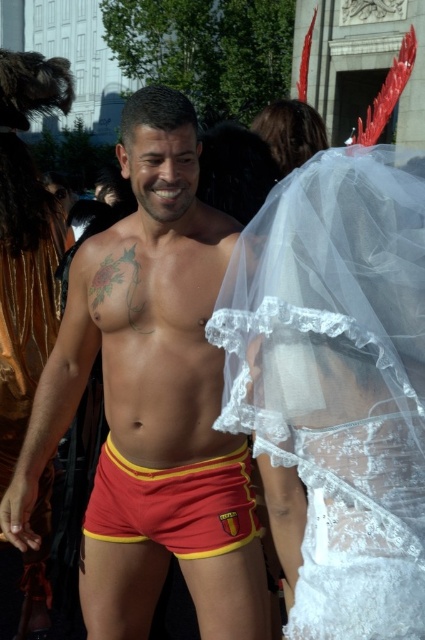
At what (x,y) coordinates should I click in order to perform the action: click on white lace veil at upper center. Please return your answer as a coordinate pair (x, y). The height and width of the screenshot is (640, 425). Looking at the image, I should click on (339, 380).

Is white lace veil at upper center bigger than red/yellow fabric shorts at center?

Correct, white lace veil at upper center is larger in size than red/yellow fabric shorts at center.

Find the location of a particular element. The height and width of the screenshot is (640, 425). white lace veil at upper center is located at coordinates (339, 380).

Which is more to the right, matte red shorts at center or red/yellow fabric shorts at center?

red/yellow fabric shorts at center is more to the right.

Does matte red shorts at center have a greater height compared to red/yellow fabric shorts at center?

Correct, matte red shorts at center is much taller as red/yellow fabric shorts at center.

Is point (54, 360) positioned in front of point (180, 472)?

That is False.

At what (x,y) coordinates should I click in order to perform the action: click on matte red shorts at center. Please return your answer as a coordinate pair (x, y). This screenshot has width=425, height=640. Looking at the image, I should click on (139, 316).

Does white lace veil at upper center have a greater width compared to matte red shorts at center?

Incorrect, white lace veil at upper center's width does not surpass matte red shorts at center's.

Is white lace veil at upper center to the right of matte red shorts at center from the viewer's perspective?

Yes, white lace veil at upper center is to the right of matte red shorts at center.

Is point (303, 449) closer to camera compared to point (65, 308)?

Yes, it is.

This screenshot has width=425, height=640. What are the coordinates of `white lace veil at upper center` in the screenshot? It's located at (339, 380).